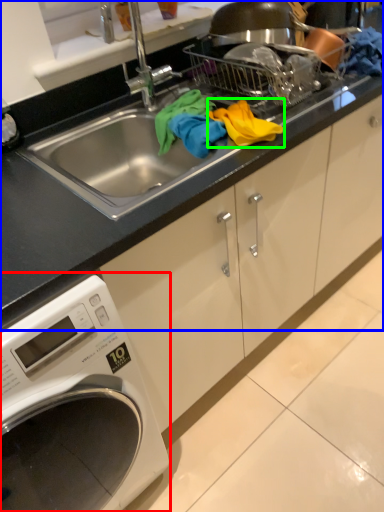
Question: Which is farther away from washing machine (highlighted by a red box)? countertop (highlighted by a blue box) or material (highlighted by a green box)?

Choices:
 (A) countertop
 (B) material

Answer: (B)